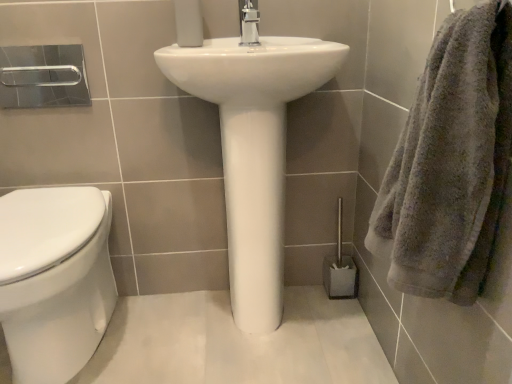
Locate an element on the screen. This screenshot has width=512, height=384. vacant space in front of gray plastic toilet brush at lower right is located at coordinates (337, 320).